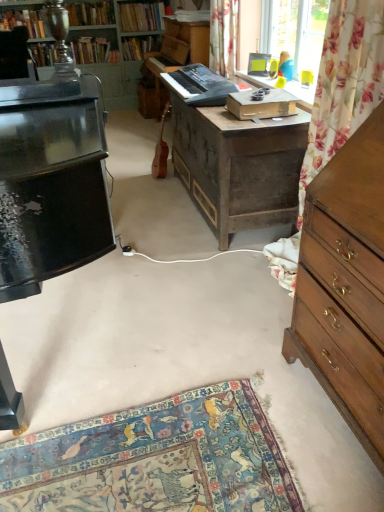
Identify the location of vacant area situated to the left side of floral fabric at upper right. Image resolution: width=384 pixels, height=512 pixels. (229, 284).